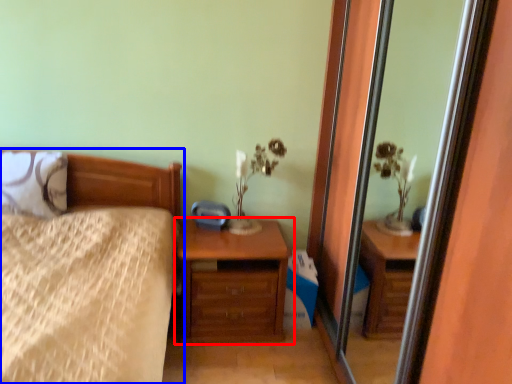
Question: Which of the following is the closest to the observer, chest of drawers (highlighted by a red box) or bed (highlighted by a blue box)?

Choices:
 (A) chest of drawers
 (B) bed

Answer: (B)